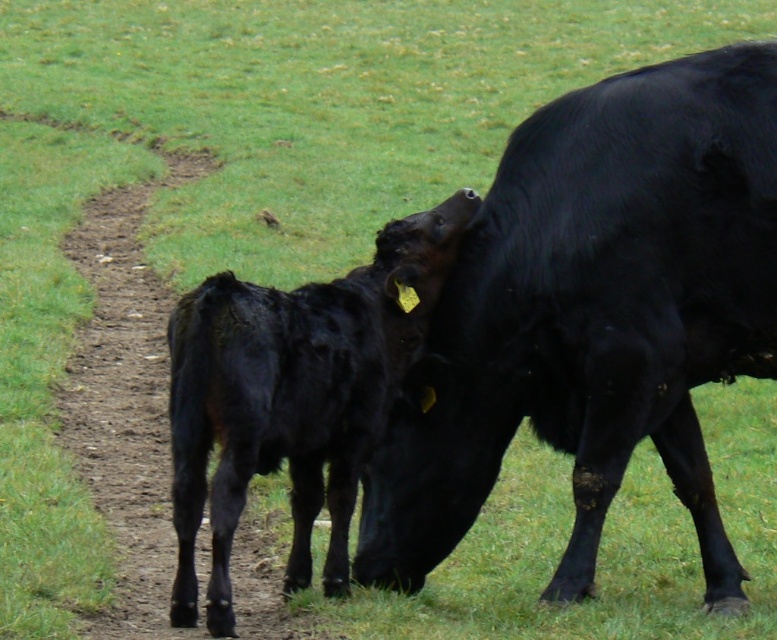
Consider the image. Which is more to the left, black smooth cow at center or shiny black calf at center?

Positioned to the left is shiny black calf at center.

Who is higher up, black smooth cow at center or shiny black calf at center?

black smooth cow at center is above.

The width and height of the screenshot is (777, 640). What do you see at coordinates (594, 314) in the screenshot? I see `black smooth cow at center` at bounding box center [594, 314].

Where is `black smooth cow at center`? This screenshot has width=777, height=640. black smooth cow at center is located at coordinates click(x=594, y=314).